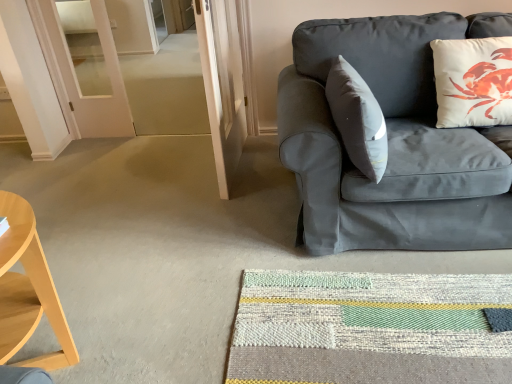
Where is `empty space that is ontop of textured woven mat at lower center (from a real-world perspective)`? empty space that is ontop of textured woven mat at lower center (from a real-world perspective) is located at coordinates tap(387, 319).